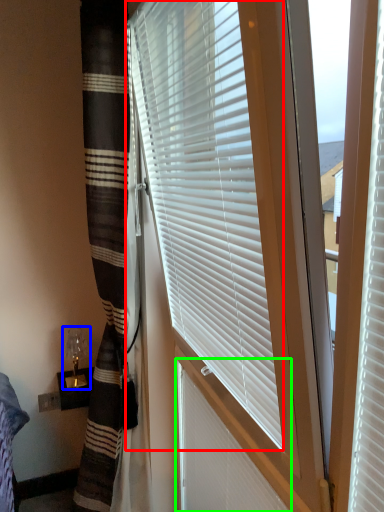
Question: Which object is positioned closest to window blind (highlighted by a red box)? Select from table lamp (highlighted by a blue box) and shutter (highlighted by a green box).

Choices:
 (A) table lamp
 (B) shutter

Answer: (B)